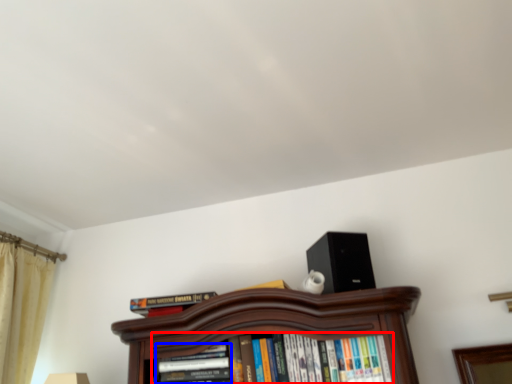
Question: Which point is further to the camera, book (highlighted by a red box) or book (highlighted by a blue box)?

Choices:
 (A) book
 (B) book

Answer: (B)